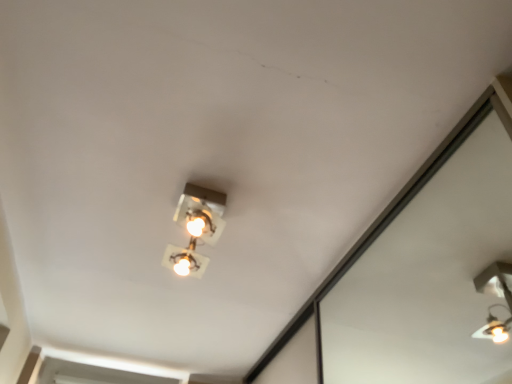
The width and height of the screenshot is (512, 384). What do you see at coordinates (196, 228) in the screenshot? I see `matte white light fixture at center` at bounding box center [196, 228].

Where is `matte white light fixture at center`? The height and width of the screenshot is (384, 512). matte white light fixture at center is located at coordinates (196, 228).

This screenshot has height=384, width=512. In order to click on matte white light fixture at center in this screenshot , I will do `click(196, 228)`.